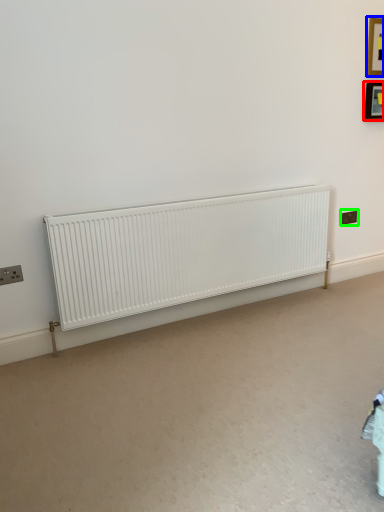
Question: Which object is positioned closest to picture frame (highlighted by a red box)? Select from picture frame (highlighted by a blue box) and electric outlet (highlighted by a green box).

Choices:
 (A) picture frame
 (B) electric outlet

Answer: (A)